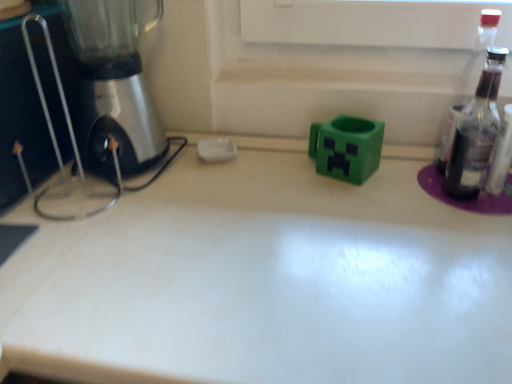
Question: Is green matte plastic mug at center far from white glossy countertop at center?

Choices:
 (A) yes
 (B) no

Answer: (B)

Question: Does green matte plastic mug at center have a lesser width compared to white glossy countertop at center?

Choices:
 (A) no
 (B) yes

Answer: (B)

Question: Does green matte plastic mug at center come in front of white glossy countertop at center?

Choices:
 (A) yes
 (B) no

Answer: (B)

Question: Is green matte plastic mug at center facing away from white glossy countertop at center?

Choices:
 (A) yes
 (B) no

Answer: (B)

Question: Is green matte plastic mug at center wider than white glossy countertop at center?

Choices:
 (A) no
 (B) yes

Answer: (A)

Question: Is transparent glass bottle at right to the left or to the right of green matte plastic mug at center in the image?

Choices:
 (A) right
 (B) left

Answer: (A)

Question: From their relative heights in the image, would you say transparent glass bottle at right is taller or shorter than green matte plastic mug at center?

Choices:
 (A) short
 (B) tall

Answer: (B)

Question: Considering the positions of transparent glass bottle at right and green matte plastic mug at center in the image, is transparent glass bottle at right wider or thinner than green matte plastic mug at center?

Choices:
 (A) wide
 (B) thin

Answer: (B)

Question: Is point (465, 67) closer or farther from the camera than point (326, 127)?

Choices:
 (A) closer
 (B) farther

Answer: (B)

Question: Is point (295, 372) positioned closer to the camera than point (352, 135)?

Choices:
 (A) closer
 (B) farther

Answer: (A)

Question: Considering the relative positions of white glossy countertop at center and green matte plastic mug at center in the image provided, is white glossy countertop at center to the left or to the right of green matte plastic mug at center?

Choices:
 (A) right
 (B) left

Answer: (A)

Question: Looking at their shapes, would you say white glossy countertop at center is wider or thinner than green matte plastic mug at center?

Choices:
 (A) thin
 (B) wide

Answer: (B)

Question: From the image's perspective, is white glossy countertop at center positioned above or below green matte plastic mug at center?

Choices:
 (A) below
 (B) above

Answer: (A)

Question: Would you say metallic silver mixer at left is inside or outside transparent glass bottle at right?

Choices:
 (A) outside
 (B) inside

Answer: (A)

Question: In terms of width, does metallic silver mixer at left look wider or thinner when compared to transparent glass bottle at right?

Choices:
 (A) thin
 (B) wide

Answer: (B)